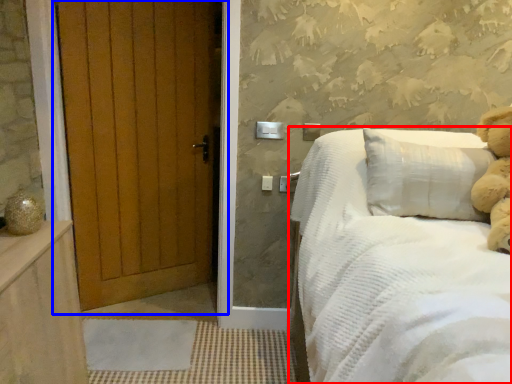
Question: Which object is further to the camera taking this photo, bed (highlighted by a red box) or door (highlighted by a blue box)?

Choices:
 (A) bed
 (B) door

Answer: (B)